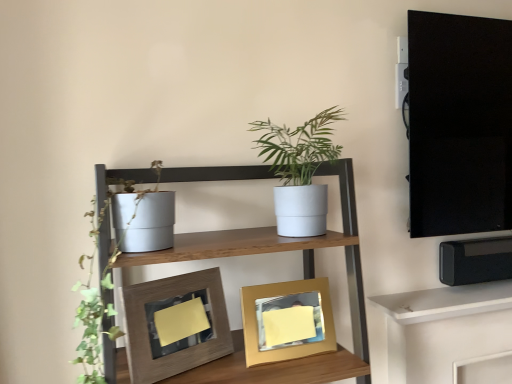
What do you see at coordinates (96, 319) in the screenshot? Image resolution: width=512 pixels, height=384 pixels. I see `matte white pot at left` at bounding box center [96, 319].

This screenshot has height=384, width=512. I want to click on matte white shelf at center, acting as the second shelf starting from the back, so click(280, 249).

The width and height of the screenshot is (512, 384). In order to click on matte white pot at left in this screenshot , I will do `click(96, 319)`.

From the image's perspective, does white matte pot at center appear higher than wooden textured frame at center, the first picture frame in the left-to-right sequence?

Correct, white matte pot at center appears higher than wooden textured frame at center, the first picture frame in the left-to-right sequence, in the image.

Is wooden textured frame at center, the first picture frame in the left-to-right sequence, completely or partially inside white matte pot at center?

No, wooden textured frame at center, the first picture frame in the left-to-right sequence, is not inside white matte pot at center.

Which of these two, white matte pot at center or wooden textured frame at center, which appears as the 2th picture frame when viewed from the right, stands taller?

white matte pot at center is taller.

Can you see white matte pot at center touching wooden textured frame at center, the first picture frame in the left-to-right sequence?

No, white matte pot at center is not making contact with wooden textured frame at center, the first picture frame in the left-to-right sequence.

Is matte white shelf at center, acting as the 1th shelf starting from the left, oriented towards matte white pot at left?

No, matte white shelf at center, acting as the 1th shelf starting from the left, is not aimed at matte white pot at left.

Who is more distant, matte white shelf at center, the first shelf when ordered from top to bottom, or matte white pot at left?

matte white pot at left is further away from the camera.

Considering the sizes of objects matte white shelf at center, the second shelf positioned from the bottom, and matte white pot at left in the image provided, who is thinner, matte white shelf at center, the second shelf positioned from the bottom, or matte white pot at left?

With smaller width is matte white pot at left.

Which object is closer to the camera, black glossy tv cabinet at upper right or wooden textured frame at center, the first picture frame in the left-to-right sequence?

wooden textured frame at center, the first picture frame in the left-to-right sequence, is closer to the camera.

In terms of size, does black glossy tv cabinet at upper right appear bigger or smaller than wooden textured frame at center, the first picture frame in the left-to-right sequence?

In the image, black glossy tv cabinet at upper right appears to be larger than wooden textured frame at center, the first picture frame in the left-to-right sequence.

From the image's perspective, between black glossy tv cabinet at upper right and wooden textured frame at center, which appears as the 2th picture frame when viewed from the right, which one is located above?

black glossy tv cabinet at upper right, from the image's perspective.

Identify the location of tv cabinet lying behind the wooden textured frame at center, which appears as the 2th picture frame when viewed from the right. (459, 124).

In the scene shown: Is wooden textured frame at center, which appears as the 2th picture frame when viewed from the right, closer to the viewer compared to matte white pot at left?

No, wooden textured frame at center, which appears as the 2th picture frame when viewed from the right, is behind matte white pot at left.

Does wooden textured frame at center, which appears as the 2th picture frame when viewed from the right, have a greater width compared to matte white pot at left?

No, wooden textured frame at center, which appears as the 2th picture frame when viewed from the right, is not wider than matte white pot at left.

Considering the sizes of objects wooden textured frame at center, the first picture frame in the left-to-right sequence, and matte white pot at left in the image provided, who is bigger, wooden textured frame at center, the first picture frame in the left-to-right sequence, or matte white pot at left?

matte white pot at left.

Is point (170, 364) positioned in front of point (87, 357)?

No.

You are a GUI agent. You are given a task and a screenshot of the screen. Output one action in this format:
    pyautogui.click(x=<x>, y=<y>)
    Task: Click on the tv cabinet above the matte white shelf at center, the second shelf positioned from the bottom (from a real-world perspective)
    The image size is (512, 384).
    Given the screenshot: What is the action you would take?
    pyautogui.click(x=459, y=124)

Is the depth of matte white shelf at center, the first shelf when ordered from top to bottom, greater than that of black glossy tv cabinet at upper right?

No, the depth of matte white shelf at center, the first shelf when ordered from top to bottom, is less than that of black glossy tv cabinet at upper right.

Could you measure the distance between matte white shelf at center, the first shelf when ordered from top to bottom, and black glossy tv cabinet at upper right?

matte white shelf at center, the first shelf when ordered from top to bottom, and black glossy tv cabinet at upper right are 60.04 centimeters apart.

Can you confirm if matte white shelf at center, acting as the 1th shelf starting from the left, is thinner than black glossy tv cabinet at upper right?

No.

Is matte white pot at left spatially inside white matte pot at center, or outside of it?

matte white pot at left cannot be found inside white matte pot at center.

Does point (92, 350) lie in front of point (256, 121)?

Yes, it is in front of point (256, 121).

From the image's perspective, which one is positioned higher, matte white pot at left or white matte pot at center?

white matte pot at center appears higher in the image.

Identify the location of shelf lying below the gold metallic picture frame at center, acting as the second picture frame starting from the left (from the image's perspective). (446, 302).

Does gold metallic picture frame at center, the first picture frame in the right-to-left sequence, have a lesser width compared to white matte shelf at upper right, marked as the 2th shelf in a front-to-back arrangement?

Yes, gold metallic picture frame at center, the first picture frame in the right-to-left sequence, is thinner than white matte shelf at upper right, marked as the 2th shelf in a front-to-back arrangement.

From the picture: Can you see gold metallic picture frame at center, the first picture frame in the right-to-left sequence, touching white matte shelf at upper right, positioned as the second shelf in top-to-bottom order?

No, gold metallic picture frame at center, the first picture frame in the right-to-left sequence, is not beside white matte shelf at upper right, positioned as the second shelf in top-to-bottom order.

Which point is more forward, [247,329] or [382,300]?

Point [247,329]

In order to click on picture frame in front of the white matte pot at center in this screenshot , I will do `click(175, 324)`.

Starting from the matte white pot at left, which shelf is the 1st one to the right? Please provide its 2D coordinates.

[(280, 249)]

Which object lies further to the anchor point gold metallic picture frame at center, the first picture frame in the right-to-left sequence, matte white shelf at center, acting as the second shelf starting from the back, or wooden textured frame at center, which appears as the 2th picture frame when viewed from the right?

Among the two, wooden textured frame at center, which appears as the 2th picture frame when viewed from the right, is located further to gold metallic picture frame at center, the first picture frame in the right-to-left sequence.

Estimate the real-world distances between objects in this image. Which object is further from white matte pot at center, wooden textured frame at center, the first picture frame in the left-to-right sequence, or gold metallic picture frame at center, acting as the second picture frame starting from the left?

Based on the image, wooden textured frame at center, the first picture frame in the left-to-right sequence, appears to be further to white matte pot at center.

Looking at the image, which one is located closer to matte white pot at left, gold metallic picture frame at center, acting as the second picture frame starting from the left, or white matte shelf at upper right, which ranks as the 2th shelf in left-to-right order?

gold metallic picture frame at center, acting as the second picture frame starting from the left, is closer to matte white pot at left.

Which object lies nearer to the anchor point wooden textured frame at center, the first picture frame in the left-to-right sequence, gold metallic picture frame at center, acting as the second picture frame starting from the left, or white matte shelf at upper right, marked as the first shelf in a right-to-left arrangement?

gold metallic picture frame at center, acting as the second picture frame starting from the left, is positioned closer to the anchor wooden textured frame at center, the first picture frame in the left-to-right sequence.

In the scene shown: Based on their spatial positions, is matte white shelf at center, the second shelf positioned from the bottom, or gold metallic picture frame at center, the first picture frame in the right-to-left sequence, closer to wooden textured frame at center, which appears as the 2th picture frame when viewed from the right?

matte white shelf at center, the second shelf positioned from the bottom, is closer to wooden textured frame at center, which appears as the 2th picture frame when viewed from the right.

Based on their spatial positions, is matte white pot at left or white matte pot at center closer to white matte shelf at upper right, marked as the first shelf in a right-to-left arrangement?

white matte pot at center lies closer to white matte shelf at upper right, marked as the first shelf in a right-to-left arrangement, than the other object.

In the scene shown: From the image, which object appears to be farther from matte white shelf at center, acting as the 1th shelf starting from the left, white matte pot at center or matte white pot at left?

Among the two, matte white pot at left is located further to matte white shelf at center, acting as the 1th shelf starting from the left.

Based on the photo, from the image, which object appears to be nearer to black glossy tv cabinet at upper right, matte white shelf at center, which is counted as the second shelf, starting from the right, or wooden textured frame at center, which appears as the 2th picture frame when viewed from the right?

matte white shelf at center, which is counted as the second shelf, starting from the right.

Where is `shelf between white matte pot at center and wooden textured frame at center, the first picture frame in the left-to-right sequence, vertically`? shelf between white matte pot at center and wooden textured frame at center, the first picture frame in the left-to-right sequence, vertically is located at coordinates (280, 249).

Find the location of a particular element. The height and width of the screenshot is (384, 512). shelf between wooden textured frame at center, which appears as the 2th picture frame when viewed from the right, and white matte shelf at upper right, positioned as the second shelf in top-to-bottom order, in the horizontal direction is located at coordinates (280, 249).

The height and width of the screenshot is (384, 512). Find the location of `houseplant between wooden textured frame at center, the first picture frame in the left-to-right sequence, and black glossy tv cabinet at upper right from left to right`. houseplant between wooden textured frame at center, the first picture frame in the left-to-right sequence, and black glossy tv cabinet at upper right from left to right is located at coordinates (298, 171).

Where is `shelf located between gold metallic picture frame at center, the first picture frame in the right-to-left sequence, and black glossy tv cabinet at upper right in the left-right direction`? shelf located between gold metallic picture frame at center, the first picture frame in the right-to-left sequence, and black glossy tv cabinet at upper right in the left-right direction is located at coordinates (446, 302).